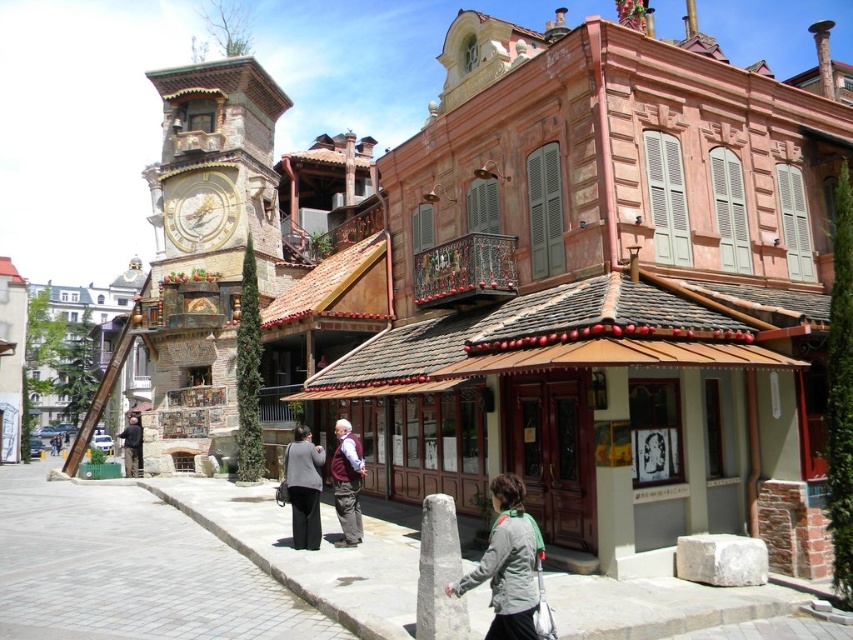
You are a city planner assessing the urban layout. You need to determine if the brown stone clock tower at left can be moved closer to the gray fabric jacket at lower right without overlapping. Considering their widths, which object has a larger footprint and might require more space?

The brown stone clock tower at left has a larger width than the gray fabric jacket at lower right, so it requires more space and might need to be considered for placement adjustments.

You are a tourist standing in front of the goldmetallicclock tower at upper left and the dark brown leather jacket at center. Which object is taller?

The goldmetallicclock tower at upper left is taller than the dark brown leather jacket at center.

You are standing in the urban scene and want to locate the point at coordinates (207, 243). Based on the scene description, which structure is this point located on?

The point at coordinates (207, 243) is located on the brown stone clock tower at left.